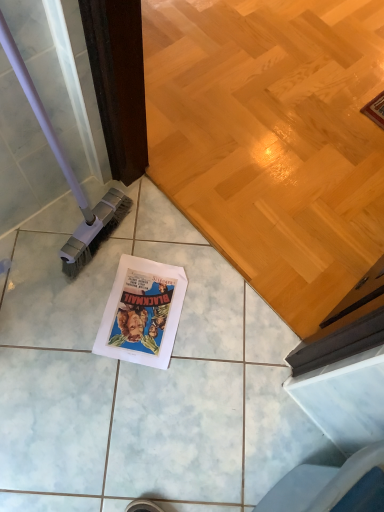
This screenshot has height=512, width=384. What do you see at coordinates (142, 312) in the screenshot?
I see `white paper comic book at center` at bounding box center [142, 312].

In order to face white paper comic book at center, should I rotate leftwards or rightwards?

You should look left and rotate roughly 6.598 degrees.

Image resolution: width=384 pixels, height=512 pixels. In order to click on white paper comic book at center in this screenshot , I will do `click(142, 312)`.

In order to click on purple plastic brush at left in this screenshot , I will do [69, 176].

Describe the element at coordinates (69, 176) in the screenshot. This screenshot has width=384, height=512. I see `purple plastic brush at left` at that location.

Identify the location of white paper comic book at center. The width and height of the screenshot is (384, 512). (142, 312).

Between purple plastic brush at left and white paper comic book at center, which one appears on the right side from the viewer's perspective?

From the viewer's perspective, white paper comic book at center appears more on the right side.

Is purple plastic brush at left closer to the viewer compared to white paper comic book at center?

Yes, the depth of purple plastic brush at left is less than that of white paper comic book at center.

Which is farther from the camera, [85,215] or [160,303]?

The point [160,303] is farther from the camera.

From the image's perspective, who appears lower, purple plastic brush at left or white paper comic book at center?

white paper comic book at center is shown below in the image.

From a real-world perspective, who is located higher, purple plastic brush at left or white paper comic book at center?

From a 3D spatial view, purple plastic brush at left is above.

Which of these two, purple plastic brush at left or white paper comic book at center, is thinner?

purple plastic brush at left is thinner.

Can you confirm if purple plastic brush at left is taller than white paper comic book at center?

Yes.

Is purple plastic brush at left bigger than white paper comic book at center?

Yes, purple plastic brush at left is bigger than white paper comic book at center.

Could white paper comic book at center be considered to be inside purple plastic brush at left?

No, purple plastic brush at left does not contain white paper comic book at center.

Is purple plastic brush at left directly adjacent to white paper comic book at center?

No, purple plastic brush at left is not in contact with white paper comic book at center.

Is purple plastic brush at left oriented towards white paper comic book at center?

Yes, purple plastic brush at left faces towards white paper comic book at center.

Identify the location of brush in front of the white paper comic book at center. (69, 176).

Between white paper comic book at center and purple plastic brush at left, which one appears on the left side from the viewer's perspective?

From the viewer's perspective, purple plastic brush at left appears more on the left side.

Does white paper comic book at center lie in front of purple plastic brush at left?

No.

Is point (123, 281) closer to viewer compared to point (106, 219)?

Yes, it is.

From the image's perspective, is white paper comic book at center above or below purple plastic brush at left?

From the image's perspective, white paper comic book at center appears below purple plastic brush at left.

From a real-world perspective, is white paper comic book at center located beneath purple plastic brush at left?

Indeed, from a real-world perspective, white paper comic book at center is positioned beneath purple plastic brush at left.

Considering the sizes of objects white paper comic book at center and purple plastic brush at left in the image provided, who is thinner, white paper comic book at center or purple plastic brush at left?

purple plastic brush at left is thinner.

Which of these two, white paper comic book at center or purple plastic brush at left, stands taller?

Result: Standing taller between the two is purple plastic brush at left.

From the picture: Is white paper comic book at center bigger than purple plastic brush at left?

Actually, white paper comic book at center might be smaller than purple plastic brush at left.

Is white paper comic book at center positioned beyond the bounds of purple plastic brush at left?

Yes.

Is white paper comic book at center in contact with purple plastic brush at left?

No, white paper comic book at center is not in contact with purple plastic brush at left.

Is white paper comic book at center oriented away from purple plastic brush at left?

white paper comic book at center does not have its back to purple plastic brush at left.

The width and height of the screenshot is (384, 512). In order to click on brush located above the white paper comic book at center (from the image's perspective) in this screenshot , I will do `click(69, 176)`.

The height and width of the screenshot is (512, 384). I want to click on comic book located underneath the purple plastic brush at left (from a real-world perspective), so click(142, 312).

Find the location of a particular element. The height and width of the screenshot is (512, 384). comic book below the purple plastic brush at left (from the image's perspective) is located at coordinates (142, 312).